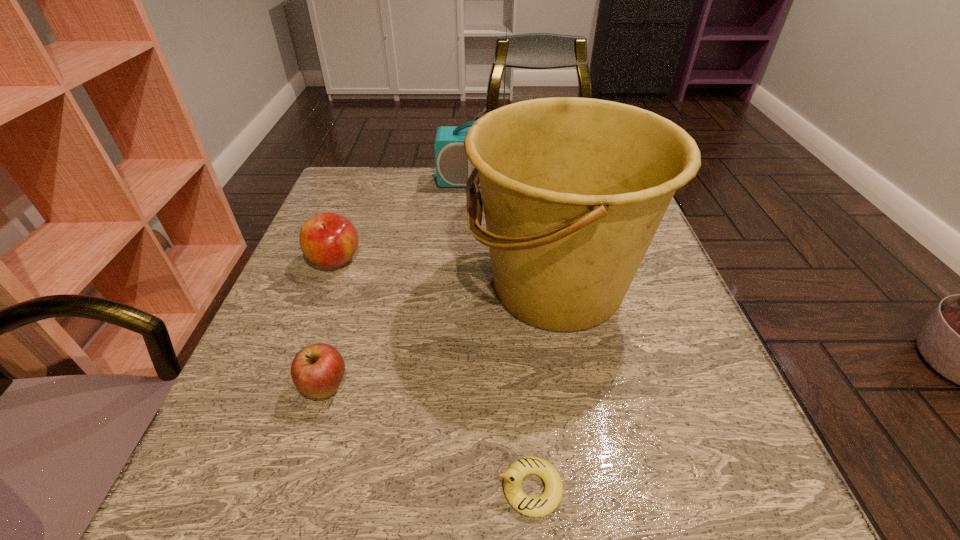
Where is `vacant region at the right edge`? The width and height of the screenshot is (960, 540). vacant region at the right edge is located at coordinates (663, 373).

The image size is (960, 540). In the image, there is a desktop. What are the coordinates of `vacant space at the far left corner` in the screenshot? It's located at (387, 170).

You are a GUI agent. You are given a task and a screenshot of the screen. Output one action in this format:
    pyautogui.click(x=<x>, y=<y>)
    Task: Click on the free region at the near left corner of the desktop
    
    Given the screenshot: What is the action you would take?
    tap(191, 500)

Locate an element on the screen. The height and width of the screenshot is (540, 960). free space at the near right corner of the desktop is located at coordinates (685, 458).

Locate an element on the screen. The width and height of the screenshot is (960, 540). vacant space in between the farthest object and the farther apple is located at coordinates (410, 221).

The image size is (960, 540). I want to click on empty location between the nearer apple and the bucket, so click(441, 338).

Locate an element on the screen. The image size is (960, 540). empty location between the farther apple and the second tallest object is located at coordinates (445, 274).

This screenshot has width=960, height=540. I want to click on empty space between the nearest object and the second nearest object, so click(x=428, y=438).

Locate an element on the screen. vacant area that lies between the bucket and the nearer apple is located at coordinates (441, 338).

Find the location of a particular element. The image size is (960, 540). unoccupied position between the farthest object and the shortest object is located at coordinates (507, 335).